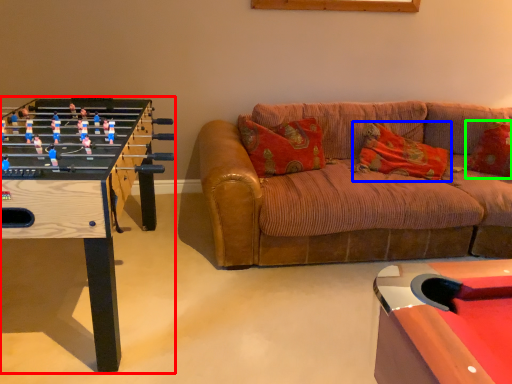
Question: Which is nearer to the table (highlighted by a red box)? pillow (highlighted by a blue box) or pillow (highlighted by a green box).

Choices:
 (A) pillow
 (B) pillow

Answer: (A)